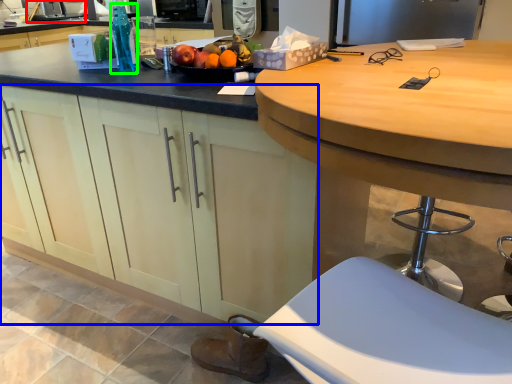
Question: Considering the real-world distances, which object is farthest from sink (highlighted by a red box)? cabinetry (highlighted by a blue box) or bottle (highlighted by a green box)?

Choices:
 (A) cabinetry
 (B) bottle

Answer: (A)